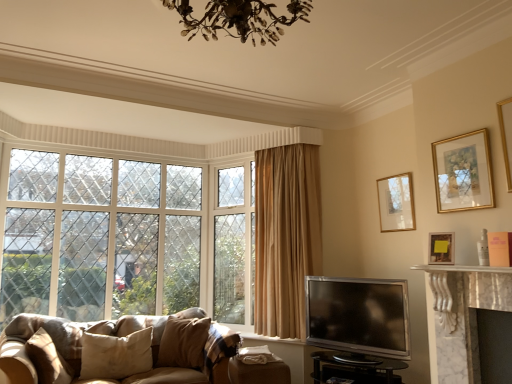
Question: From the image's perspective, relative to black glass tv stand at lower center, is silver metallic tv at lower right above or below?

Choices:
 (A) below
 (B) above

Answer: (B)

Question: In terms of width, does silver metallic tv at lower right look wider or thinner when compared to black glass tv stand at lower center?

Choices:
 (A) wide
 (B) thin

Answer: (B)

Question: Which object is positioned closest to the matte gold picture frame at upper right, placed as the second picture frame when sorted from front to back?

Choices:
 (A) black glass tv stand at lower center
 (B) clear glass window at left
 (C) gold-framed picture at upper right, marked as the third picture frame in a back-to-front arrangement
 (D) wooden picture frame at upper right, the first picture frame when ordered from back to front
 (E) beige fabric pillow at lower left, acting as the 1th pillow starting from the left

Answer: (C)

Question: Considering the real-world distances, which object is closest to the beige fabric pillow at lower left, acting as the 1th pillow starting from the left?

Choices:
 (A) wooden picture frame at upper right, the first picture frame when ordered from back to front
 (B) velvet beige pillow at lower center, which ranks as the first pillow in right-to-left order
 (C) suede-like beige couch at lower left
 (D) silver metallic tv at lower right
 (E) beige cotton pillow at lower left, arranged as the second pillow when viewed from the right

Answer: (E)